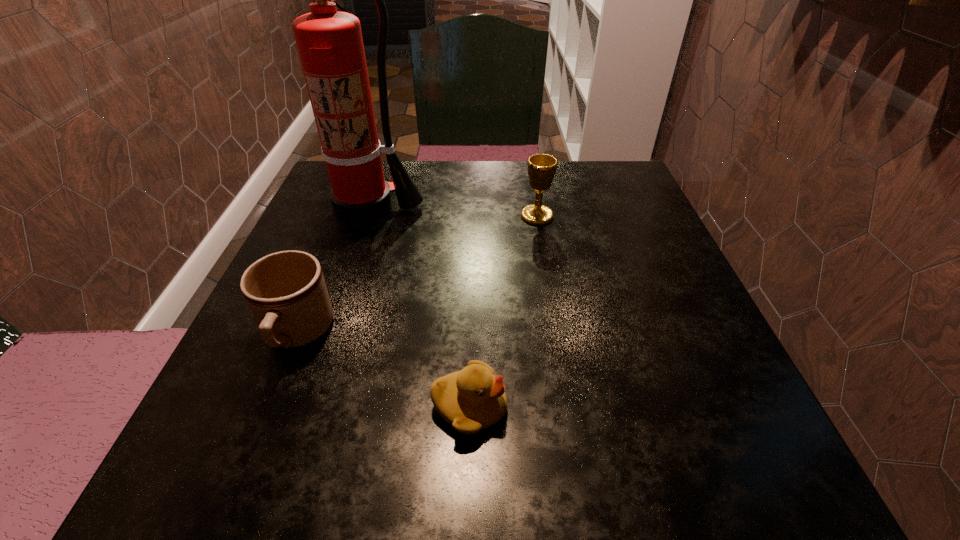
At what (x,y) coordinates should I click in order to perform the action: click on fire extinguisher. Please return your answer as a coordinate pair (x, y). The width and height of the screenshot is (960, 540). Looking at the image, I should click on (330, 45).

I want to click on chalice, so click(541, 169).

Image resolution: width=960 pixels, height=540 pixels. In order to click on the second shortest object in this screenshot , I will do `click(286, 292)`.

Identify the location of mug. (286, 292).

Find the location of a particular element. the third object from left to right is located at coordinates (472, 399).

Where is `the shortest object`? the shortest object is located at coordinates (472, 399).

Image resolution: width=960 pixels, height=540 pixels. Identify the location of vacant space located at the nozzle of the tallest object. (342, 286).

The height and width of the screenshot is (540, 960). Identify the location of vacant space located on the front of the rightmost object. (541, 240).

Where is `blank area located on the side of the third tallest object with the handle`? blank area located on the side of the third tallest object with the handle is located at coordinates [x=265, y=416].

You are a GUI agent. You are given a task and a screenshot of the screen. Output one action in this format:
    pyautogui.click(x=<x>, y=<y>)
    Task: Click on the blank space located 0.170m on the front-facing side of the nearest object
    This screenshot has height=540, width=960.
    Given the screenshot: What is the action you would take?
    pyautogui.click(x=629, y=407)